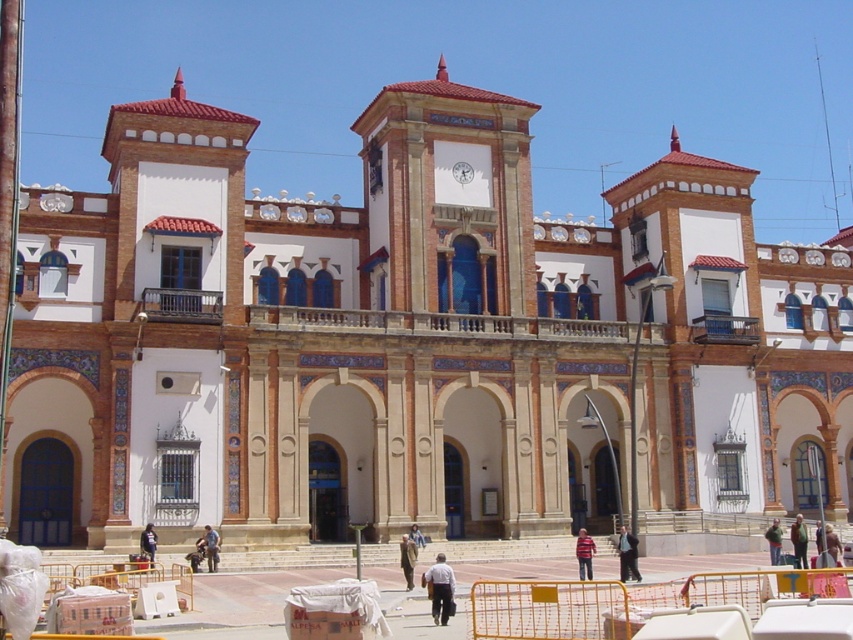
Who is positioned more to the left, green fabric jacket at center or brown leather jacket at center?

brown leather jacket at center

Can you confirm if green fabric jacket at center is smaller than brown leather jacket at center?

No.

Which is in front, point (793, 529) or point (409, 560)?

Point (409, 560) is more forward.

Identify the location of green fabric jacket at center. This screenshot has height=640, width=853. (799, 541).

Between light brown leather jacket at center and brown leather jacket at center, which one has less height?

light brown leather jacket at center is shorter.

How much distance is there between light brown leather jacket at center and brown leather jacket at center?

light brown leather jacket at center is 8.06 meters from brown leather jacket at center.

Locate an element on the screen. Image resolution: width=853 pixels, height=640 pixels. light brown leather jacket at center is located at coordinates (209, 547).

Between dark suit at lower right and brown leather jacket at center, which one has more height?

dark suit at lower right

Is dark suit at lower right behind brown leather jacket at center?

That is True.

This screenshot has width=853, height=640. Identify the location of dark suit at lower right. (627, 554).